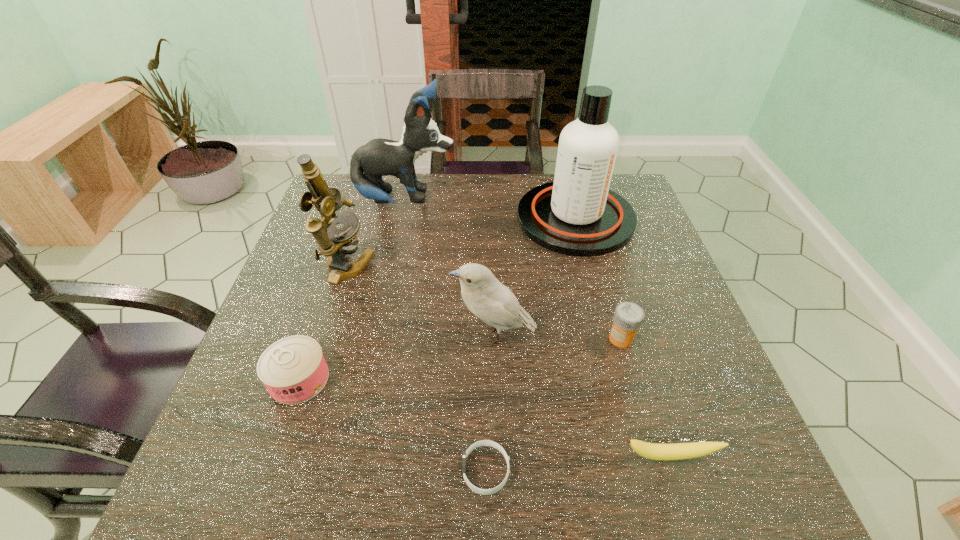
Identify the location of vacant space located on the back of the microscope. This screenshot has width=960, height=540. (370, 194).

Where is `vacant space situated 0.230m at the beak of the bird`? This screenshot has width=960, height=540. vacant space situated 0.230m at the beak of the bird is located at coordinates (344, 334).

Where is `vacant space located at the beak of the bird`? vacant space located at the beak of the bird is located at coordinates (423, 334).

Where is `blank space located 0.130m at the beak of the bird`? blank space located 0.130m at the beak of the bird is located at coordinates (391, 334).

This screenshot has width=960, height=540. Find the location of `blank space located on the label side of the fourth shortest object`. blank space located on the label side of the fourth shortest object is located at coordinates (423, 339).

The width and height of the screenshot is (960, 540). I want to click on blank area located 0.280m on the label side of the fourth shortest object, so click(475, 339).

Locate an element on the screen. The width and height of the screenshot is (960, 540). free space located 0.300m on the label side of the fourth shortest object is located at coordinates (467, 339).

Image resolution: width=960 pixels, height=540 pixels. Find the location of `free space located on the front of the third nearest object`. free space located on the front of the third nearest object is located at coordinates (270, 465).

Image resolution: width=960 pixels, height=540 pixels. Identify the location of vacant area located on the upward curve of the banana. (685, 508).

Image resolution: width=960 pixels, height=540 pixels. In order to click on free space located 0.200m on the outer surface of the wristband in this screenshot , I will do `click(342, 470)`.